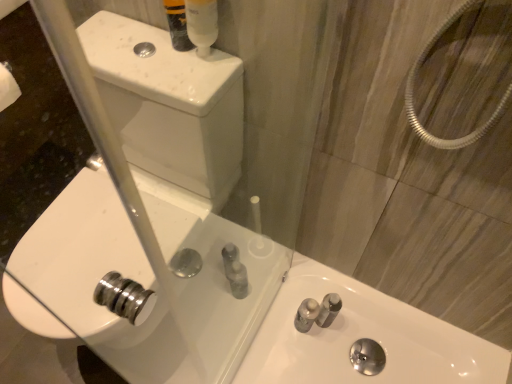
Question: Considering the relative positions of white glossy sink at lower right, the first sink positioned from the right, and white glossy sink at center, which is counted as the first sink, starting from the left, in the image provided, is white glossy sink at lower right, the first sink positioned from the right, to the left of white glossy sink at center, which is counted as the first sink, starting from the left, from the viewer's perspective?

Choices:
 (A) no
 (B) yes

Answer: (A)

Question: Is white glossy sink at lower right, the 2th sink when ordered from left to right, aimed at white glossy sink at center, which is counted as the first sink, starting from the left?

Choices:
 (A) yes
 (B) no

Answer: (B)

Question: Is white glossy sink at lower right, the first sink positioned from the right, to the right of white glossy sink at center, which is counted as the first sink, starting from the left, from the viewer's perspective?

Choices:
 (A) yes
 (B) no

Answer: (A)

Question: Considering the relative sizes of white glossy sink at lower right, the first sink positioned from the right, and white glossy sink at center, which is counted as the first sink, starting from the left, in the image provided, is white glossy sink at lower right, the first sink positioned from the right, wider than white glossy sink at center, which is counted as the first sink, starting from the left,?

Choices:
 (A) no
 (B) yes

Answer: (B)

Question: Considering the relative sizes of white glossy sink at lower right, the first sink positioned from the right, and white glossy sink at center, the 2th sink when ordered from right to left, in the image provided, is white glossy sink at lower right, the first sink positioned from the right, shorter than white glossy sink at center, the 2th sink when ordered from right to left,?

Choices:
 (A) yes
 (B) no

Answer: (A)

Question: Considering their positions, is translucent plastic mouthwash at upper center located in front of or behind white glossy sink at center, the 2th sink when ordered from right to left?

Choices:
 (A) front
 (B) behind

Answer: (B)

Question: From the image's perspective, is translucent plastic mouthwash at upper center above or below white glossy sink at center, the 2th sink when ordered from right to left?

Choices:
 (A) above
 (B) below

Answer: (A)

Question: In terms of width, does translucent plastic mouthwash at upper center look wider or thinner when compared to white glossy sink at center, which is counted as the first sink, starting from the left?

Choices:
 (A) thin
 (B) wide

Answer: (A)

Question: From a real-world perspective, is translucent plastic mouthwash at upper center above or below white glossy sink at center, the 2th sink when ordered from right to left?

Choices:
 (A) below
 (B) above

Answer: (B)

Question: Relative to translucent plastic mouthwash at upper center, is white glossy sink at lower right, the first sink positioned from the right, in front or behind?

Choices:
 (A) behind
 (B) front

Answer: (A)

Question: Would you say white glossy sink at lower right, the 2th sink when ordered from left to right, is inside or outside translucent plastic mouthwash at upper center?

Choices:
 (A) inside
 (B) outside

Answer: (B)

Question: In terms of width, does white glossy sink at lower right, the 2th sink when ordered from left to right, look wider or thinner when compared to translucent plastic mouthwash at upper center?

Choices:
 (A) thin
 (B) wide

Answer: (B)

Question: Is point (501, 367) closer or farther from the camera than point (194, 29)?

Choices:
 (A) farther
 (B) closer

Answer: (A)

Question: Would you say white glossy sink at center, which is counted as the first sink, starting from the left, is inside or outside translucent plastic mouthwash at upper center?

Choices:
 (A) inside
 (B) outside

Answer: (B)

Question: From the image's perspective, relative to translucent plastic mouthwash at upper center, is white glossy sink at center, which is counted as the first sink, starting from the left, above or below?

Choices:
 (A) above
 (B) below

Answer: (B)